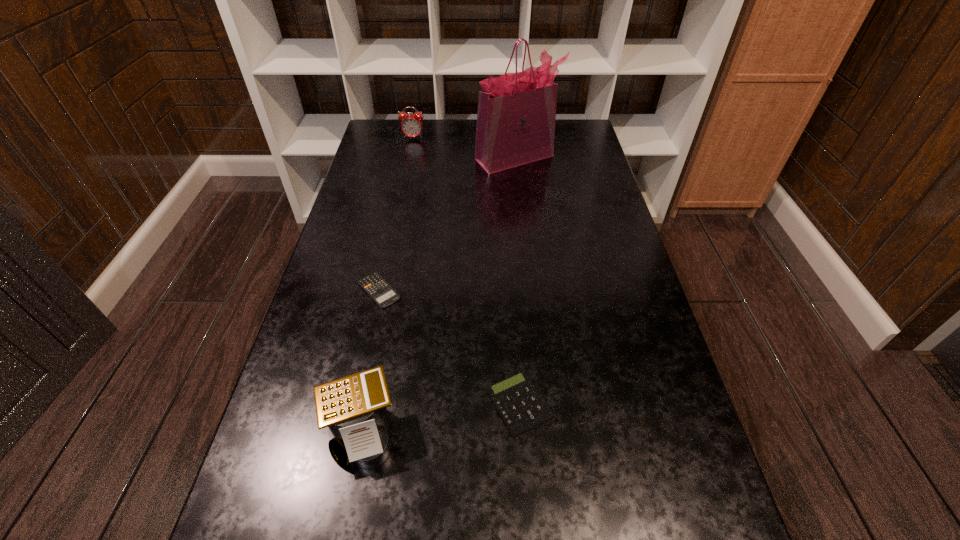
Locate an element on the screen. free spot between the rightmost calculator and the tallest calculator is located at coordinates (441, 418).

The image size is (960, 540). In order to click on free area in between the second farthest object and the rightmost calculator in this screenshot , I will do `click(517, 281)`.

Locate an element on the screen. The height and width of the screenshot is (540, 960). free space that is in between the tallest object and the farthest calculator is located at coordinates (447, 224).

The height and width of the screenshot is (540, 960). I want to click on object that is the second closest to the farthest object, so click(374, 285).

In order to click on object that can be found as the closest to the tallest calculator in this screenshot , I will do `click(521, 407)`.

Identify the location of calculator that stands as the closest to the tallest calculator. (521, 407).

I want to click on calculator identified as the second closest to the shopping bag, so click(521, 407).

You are a GUI agent. You are given a task and a screenshot of the screen. Output one action in this format:
    pyautogui.click(x=<x>, y=<y>)
    Task: Click on the free location that satisfies the following two spatial constraints: 1. on the back side of the shopping bag; 2. on the right side of the second shortest calculator
    
    Given the screenshot: What is the action you would take?
    pyautogui.click(x=503, y=158)

You are a GUI agent. You are given a task and a screenshot of the screen. Output one action in this format:
    pyautogui.click(x=<x>, y=<y>)
    Task: Click on the vacant position in the image that satisfies the following two spatial constraints: 1. on the face of the tallest calculator; 2. on the left side of the alarm clock
    This screenshot has width=960, height=540.
    Given the screenshot: What is the action you would take?
    pyautogui.click(x=351, y=431)

Where is `free space that satisfies the following two spatial constraints: 1. on the back side of the tallest calculator; 2. on the right side of the fourth tallest object`? The width and height of the screenshot is (960, 540). free space that satisfies the following two spatial constraints: 1. on the back side of the tallest calculator; 2. on the right side of the fourth tallest object is located at coordinates (368, 404).